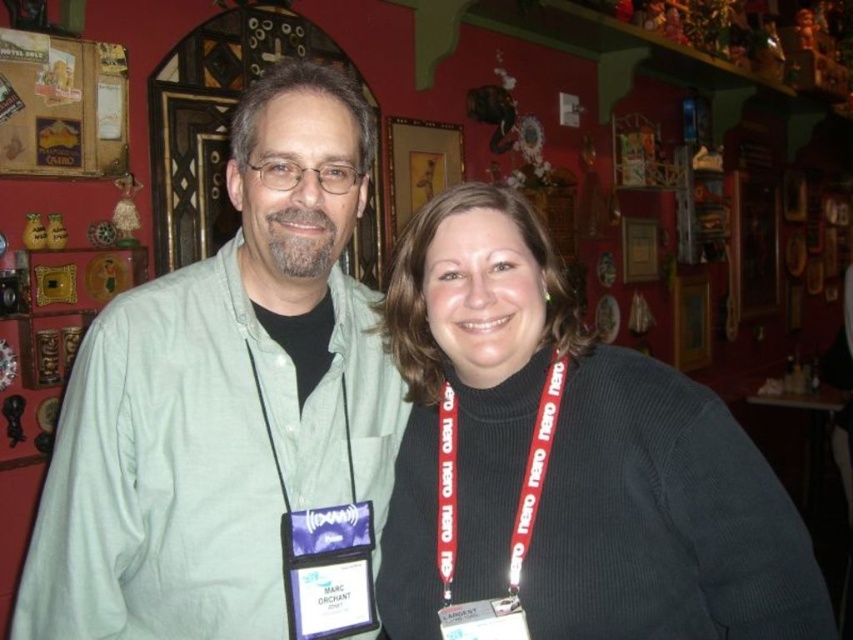
Is red fabric lanyard at center to the right of black fabric neck at center from the viewer's perspective?

Yes, red fabric lanyard at center is to the right of black fabric neck at center.

Is red fabric lanyard at center positioned in front of black fabric neck at center?

Yes, red fabric lanyard at center is in front of black fabric neck at center.

The width and height of the screenshot is (853, 640). I want to click on red fabric lanyard at center, so click(x=514, y=522).

Where is `red fabric lanyard at center`? This screenshot has width=853, height=640. red fabric lanyard at center is located at coordinates (514, 522).

In the scene shown: Is dark gray sweater at center bigger than black fabric neck at center?

Yes.

Can you confirm if dark gray sweater at center is thinner than black fabric neck at center?

No.

Which is behind, point (790, 524) or point (486, 248)?

The point (486, 248) is more distant.

At what (x,y) coordinates should I click in order to perform the action: click on dark gray sweater at center. Please return your answer as a coordinate pair (x, y). The height and width of the screenshot is (640, 853). Looking at the image, I should click on (570, 467).

Is point (283, 260) closer to camera compared to point (486, 339)?

No, (283, 260) is behind (486, 339).

Is black matte neck at center positioned before black fabric neck at center?

No, black matte neck at center is behind black fabric neck at center.

At what (x,y) coordinates should I click in order to perform the action: click on black matte neck at center. Please return your answer as a coordinate pair (x, y). This screenshot has width=853, height=640. Looking at the image, I should click on (286, 269).

Where is `black matte neck at center`? black matte neck at center is located at coordinates (286, 269).